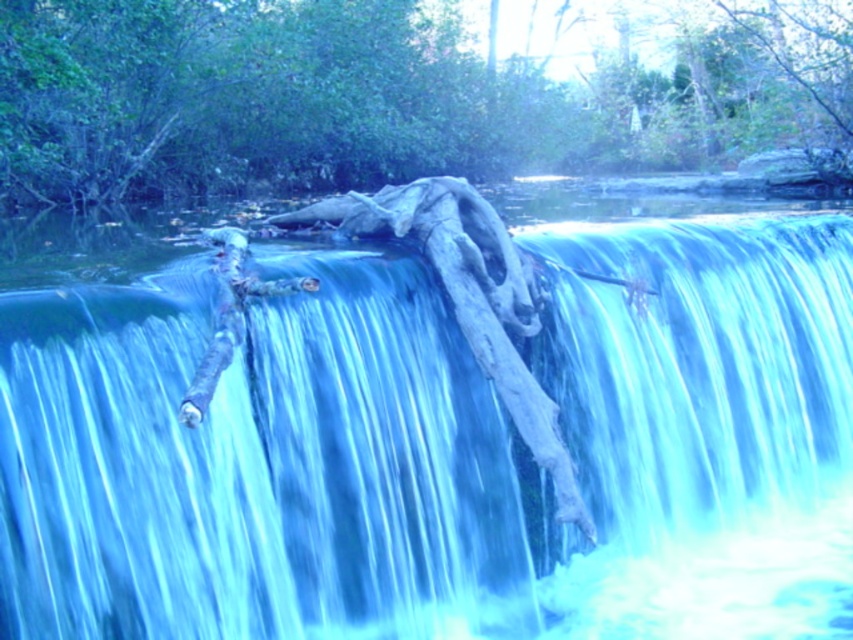
You are a hiker who wants to cross the waterfall using the logs provided. The smooth wood log at center is 1.5 meters long and the smooth bark log at center is 2 meters long. Which log would you choose to safely cross the waterfall?

The smooth bark log at center is longer than the smooth wood log at center, so choosing the smooth bark log at center would be safer as it spans the waterfall more effectively.

You are a hiker who wants to cross the waterfall using the logs provided. The smooth wood log at center and the smooth bark log at center are both available. Which log would you choose to walk on if you prefer a narrower path?

The smooth wood log at center is thinner than smooth bark log at center, so you should choose the smooth wood log at center for a narrower path.

Consider the image. Based on the scene description, what object is located at the coordinates point (434, 438)?

The smooth wood log at center is located at point (434, 438).